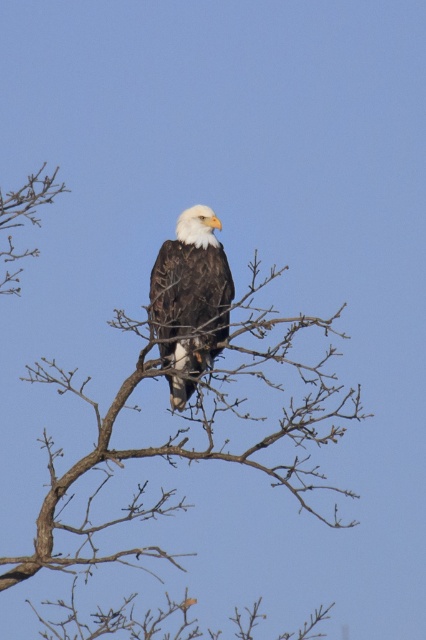
Question: Observing the image, what is the correct spatial positioning of brown wood tree branch at center in reference to white-feathered bald eagle at center?

Choices:
 (A) below
 (B) above

Answer: (A)

Question: Which point appears farthest from the camera in this image?

Choices:
 (A) (215, 426)
 (B) (198, 285)

Answer: (A)

Question: Which point appears closest to the camera in this image?

Choices:
 (A) (227, 280)
 (B) (78, 563)

Answer: (B)

Question: Can you confirm if brown wood tree branch at center is wider than white-feathered bald eagle at center?

Choices:
 (A) yes
 (B) no

Answer: (A)

Question: Is brown wood tree branch at center below white-feathered bald eagle at center?

Choices:
 (A) no
 (B) yes

Answer: (B)